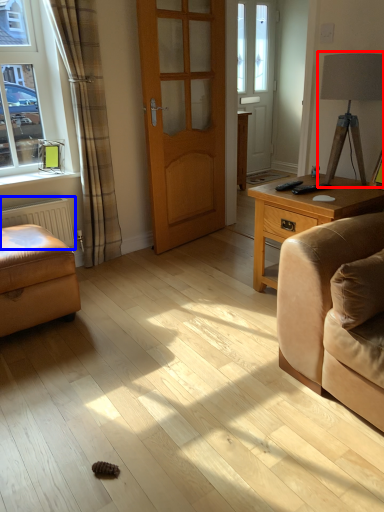
Question: Which point is further to the camera, table lamp (highlighted by a red box) or radiator (highlighted by a blue box)?

Choices:
 (A) table lamp
 (B) radiator

Answer: (B)